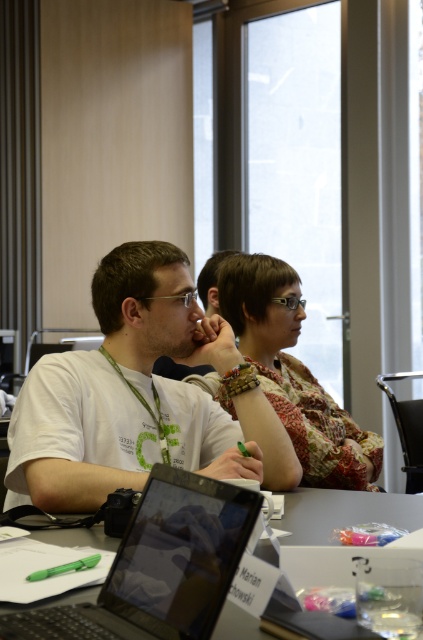
Question: Which point is farther to the camera?

Choices:
 (A) (296, 445)
 (B) (208, 336)
 (C) (189, 490)

Answer: (A)

Question: Does matte black laptop at center have a smaller size compared to patterned fabric blouse at center?

Choices:
 (A) no
 (B) yes

Answer: (B)

Question: Is white matte t-shirt at center to the right of matte black laptop at center from the viewer's perspective?

Choices:
 (A) yes
 (B) no

Answer: (A)

Question: Which point is closer to the camera?

Choices:
 (A) matte black laptop at center
 (B) white matte t-shirt at center

Answer: (A)

Question: Which of these objects is positioned closest to the patterned fabric blouse at center?

Choices:
 (A) matte black laptop at center
 (B) white matte t-shirt at center

Answer: (B)

Question: Can you confirm if white matte t-shirt at center is wider than patterned fabric blouse at center?

Choices:
 (A) no
 (B) yes

Answer: (B)